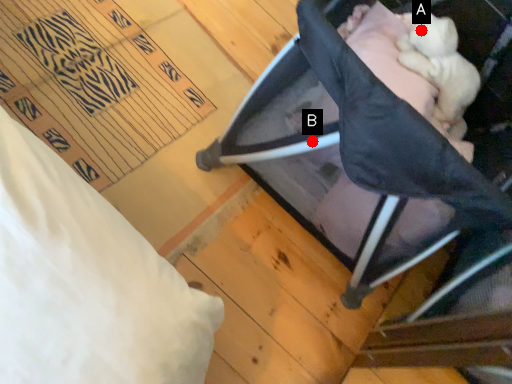
Question: Two points are circled on the image, labeled by A and B beside each circle. Which of the following is the farthest from the observer?

Choices:
 (A) A is further
 (B) B is further

Answer: (A)